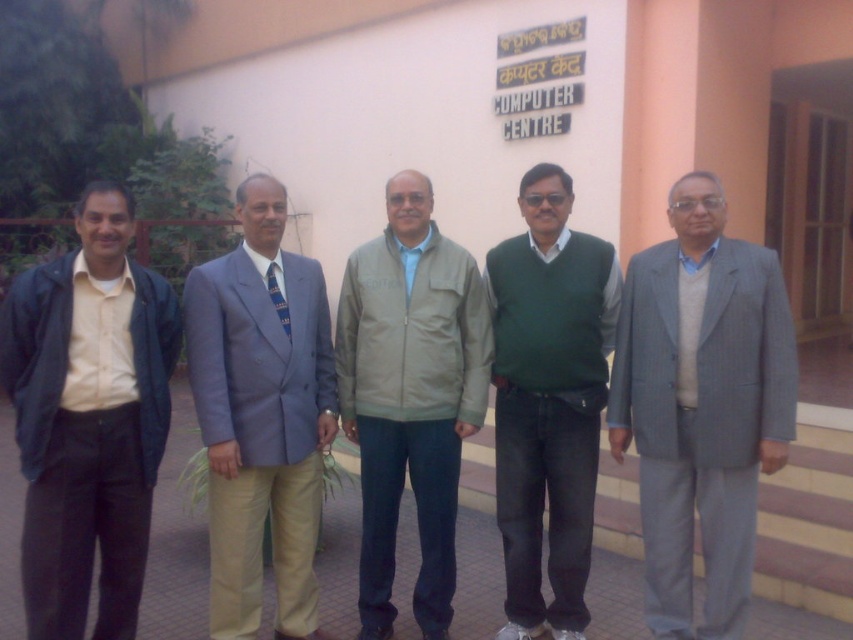
Is light blue fabric suit at center behind blue striped tie at center?

No, light blue fabric suit at center is in front of blue striped tie at center.

Is light blue fabric suit at center above blue striped tie at center?

No.

Which is in front, point (305, 321) or point (283, 304)?

Point (283, 304)

Where is `light blue fabric suit at center`? This screenshot has height=640, width=853. light blue fabric suit at center is located at coordinates click(260, 417).

Is gray pinstripe suit at right bigger than blue striped tie at center?

Yes.

Can you confirm if gray pinstripe suit at right is wider than blue striped tie at center?

Yes.

Who is more distant from viewer, (627, 416) or (285, 308)?

The point (627, 416) is more distant.

At what (x,y) coordinates should I click in order to perform the action: click on gray pinstripe suit at right. Please return your answer as a coordinate pair (x, y). Looking at the image, I should click on [x=701, y=404].

Does gray pinstripe suit at right have a larger size compared to light beige jacket at center?

No, gray pinstripe suit at right is not bigger than light beige jacket at center.

Is gray pinstripe suit at right thinner than light beige jacket at center?

Yes.

Where is `gray pinstripe suit at right`? The image size is (853, 640). gray pinstripe suit at right is located at coordinates (701, 404).

This screenshot has height=640, width=853. What are the coordinates of `gray pinstripe suit at right` in the screenshot? It's located at (701, 404).